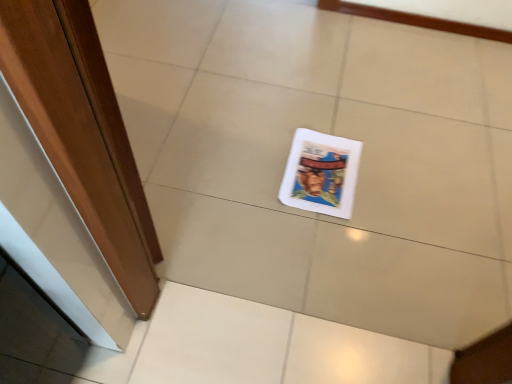
This screenshot has width=512, height=384. I want to click on free point in front of white glossy magazine at center, so click(x=325, y=245).